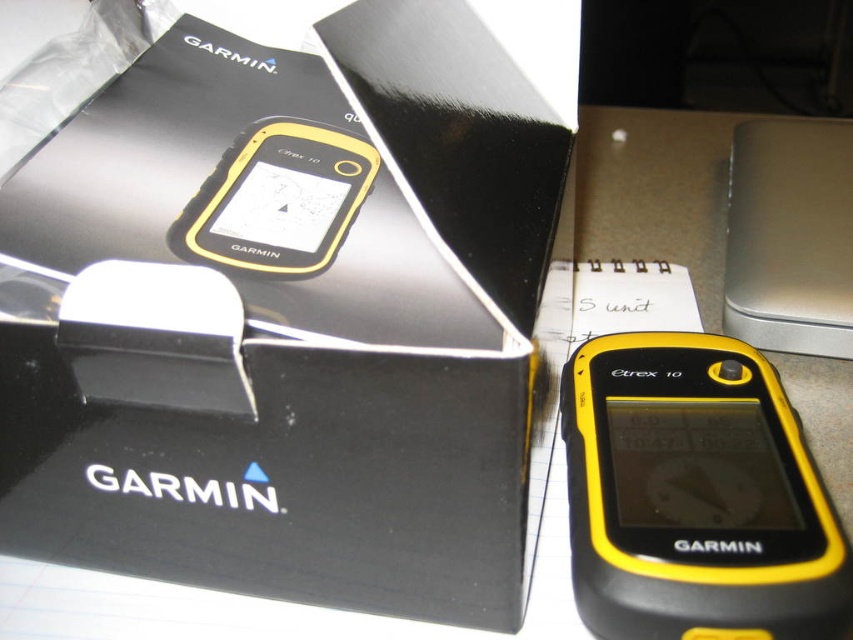
Is the position of black matte box at center more distant than that of yellow matte/gps device at center?

No, it is in front of yellow matte/gps device at center.

Is black matte box at center to the right of yellow matte/gps device at center from the viewer's perspective?

No, black matte box at center is not to the right of yellow matte/gps device at center.

This screenshot has height=640, width=853. Identify the location of black matte box at center. (297, 312).

Find the location of `black matte box at center`. black matte box at center is located at coordinates (297, 312).

You are a GUI agent. You are given a task and a screenshot of the screen. Output one action in this format:
    pyautogui.click(x=<x>, y=<y>)
    Task: Click on the black matte box at center
    The height and width of the screenshot is (640, 853).
    Given the screenshot: What is the action you would take?
    pyautogui.click(x=297, y=312)

Does yellow matte/gps device at center appear on the right side of yellow matte gps device at center?

Indeed, yellow matte/gps device at center is positioned on the right side of yellow matte gps device at center.

Between yellow matte/gps device at center and yellow matte gps device at center, which one is positioned lower?

yellow matte/gps device at center is lower down.

Does point (672, 358) come behind point (264, 230)?

Yes, it is.

The width and height of the screenshot is (853, 640). Find the location of `yellow matte/gps device at center`. yellow matte/gps device at center is located at coordinates (695, 496).